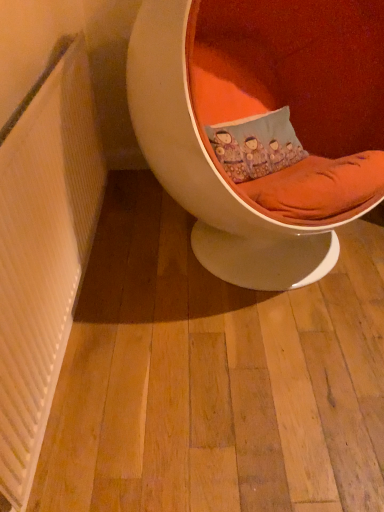
At what (x,y) coordinates should I click in order to perform the action: click on space that is in front of white glossy pod chair at center. Please return your answer as a coordinate pair (x, y). Looking at the image, I should click on (242, 386).